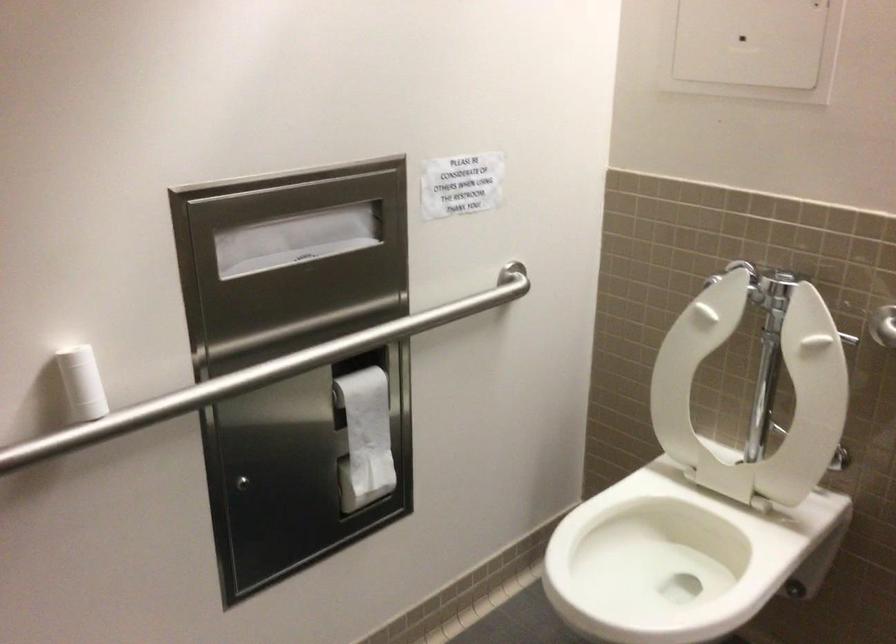
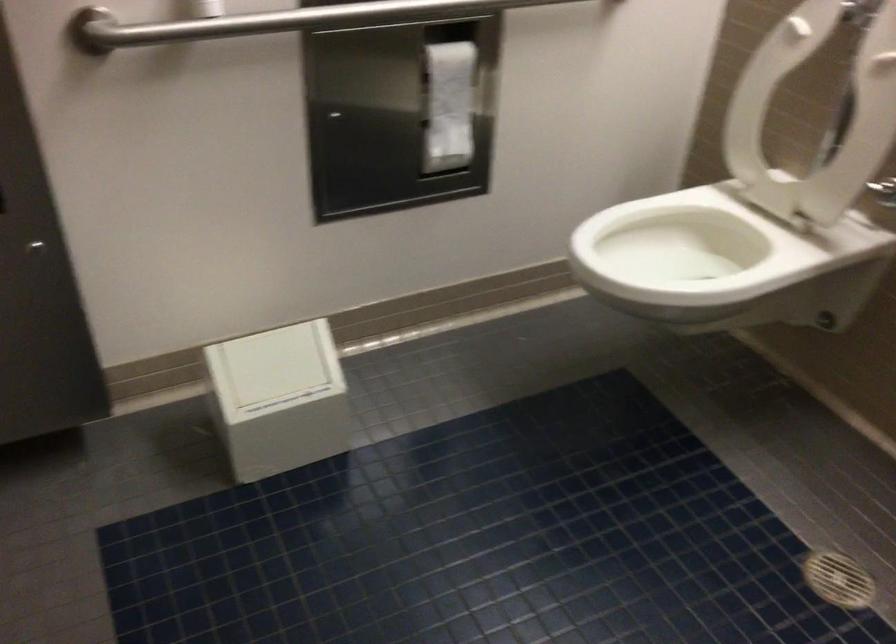
In the second image, find the point that corresponds to [369,430] in the first image.

(450, 98)